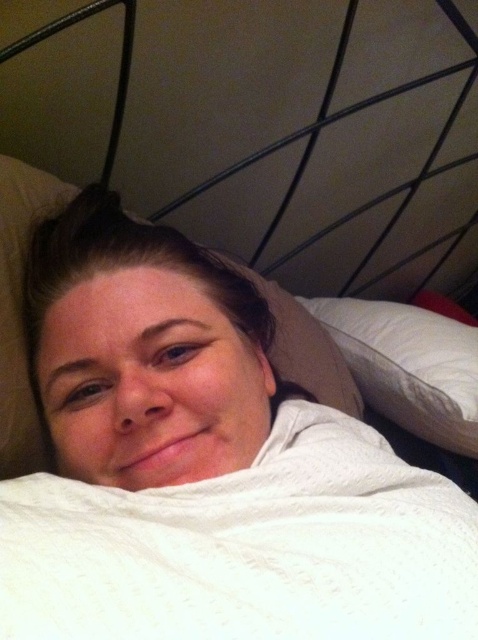
Question: Can you confirm if metallic black headboard at upper center is positioned to the right of white soft pillow at center?

Choices:
 (A) no
 (B) yes

Answer: (B)

Question: Based on their relative distances, which object is nearer to the white soft pillow at upper center?

Choices:
 (A) metallic black headboard at upper center
 (B) white soft pillow at center

Answer: (B)

Question: Does metallic black headboard at upper center appear on the left side of white soft pillow at center?

Choices:
 (A) yes
 (B) no

Answer: (B)

Question: Can you confirm if white knitted blanket at center is thinner than white soft pillow at center?

Choices:
 (A) no
 (B) yes

Answer: (A)

Question: Which object is the closest to the white knitted blanket at center?

Choices:
 (A) white soft pillow at upper center
 (B) white soft pillow at center
 (C) metallic black headboard at upper center

Answer: (A)

Question: Estimate the real-world distances between objects in this image. Which object is closer to the white knitted blanket at center?

Choices:
 (A) white soft pillow at center
 (B) white soft pillow at upper center
 (C) metallic black headboard at upper center

Answer: (B)